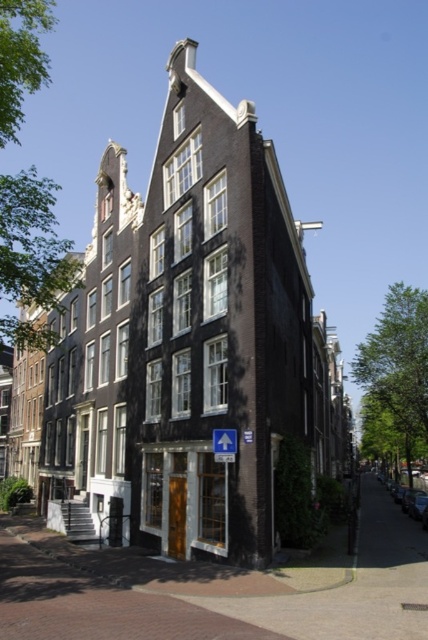
Question: Is shiny silver sedan at right bigger than blue plastic arrow at upper center?

Choices:
 (A) yes
 (B) no

Answer: (A)

Question: Considering the relative positions of shiny silver sedan at right and blue plastic arrow at upper center in the image provided, where is shiny silver sedan at right located with respect to blue plastic arrow at upper center?

Choices:
 (A) right
 (B) left

Answer: (A)

Question: Can you confirm if shiny silver sedan at right is thinner than blue plastic arrow at upper center?

Choices:
 (A) no
 (B) yes

Answer: (A)